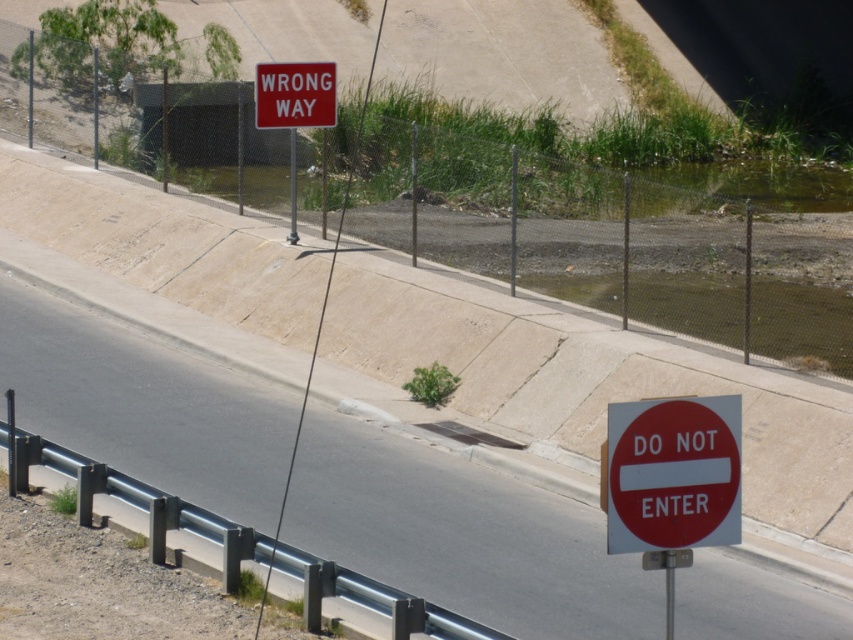
In the scene shown: How far apart are red plastic sign at right and red matte sign at upper center?

red plastic sign at right is 5.28 meters from red matte sign at upper center.

Which is more to the right, red plastic sign at right or red matte sign at upper center?

red matte sign at upper center

Does point (386, 484) come in front of point (280, 70)?

Yes, it is in front of point (280, 70).

I want to click on red plastic sign at right, so click(463, 538).

Based on the photo, does red plastic sign at right have a lesser width compared to red matte do not enter sign at lower right?

In fact, red plastic sign at right might be wider than red matte do not enter sign at lower right.

Between point (321, 492) and point (740, 410), which one is positioned behind?

Point (321, 492)

The height and width of the screenshot is (640, 853). Identify the location of red plastic sign at right. (463, 538).

You are a GUI agent. You are given a task and a screenshot of the screen. Output one action in this format:
    pyautogui.click(x=<x>, y=<y>)
    Task: Click on the red plastic sign at right
    The width and height of the screenshot is (853, 640).
    Given the screenshot: What is the action you would take?
    [463, 538]

Can you confirm if red matte do not enter sign at lower right is positioned above red matte sign at upper center?

Actually, red matte do not enter sign at lower right is below red matte sign at upper center.

From the picture: Can you confirm if red matte do not enter sign at lower right is positioned below red matte sign at upper center?

Correct, red matte do not enter sign at lower right is located below red matte sign at upper center.

Between point (624, 442) and point (270, 99), which one is positioned behind?

The point (270, 99) is behind.

The width and height of the screenshot is (853, 640). In order to click on red matte do not enter sign at lower right in this screenshot , I will do `click(672, 474)`.